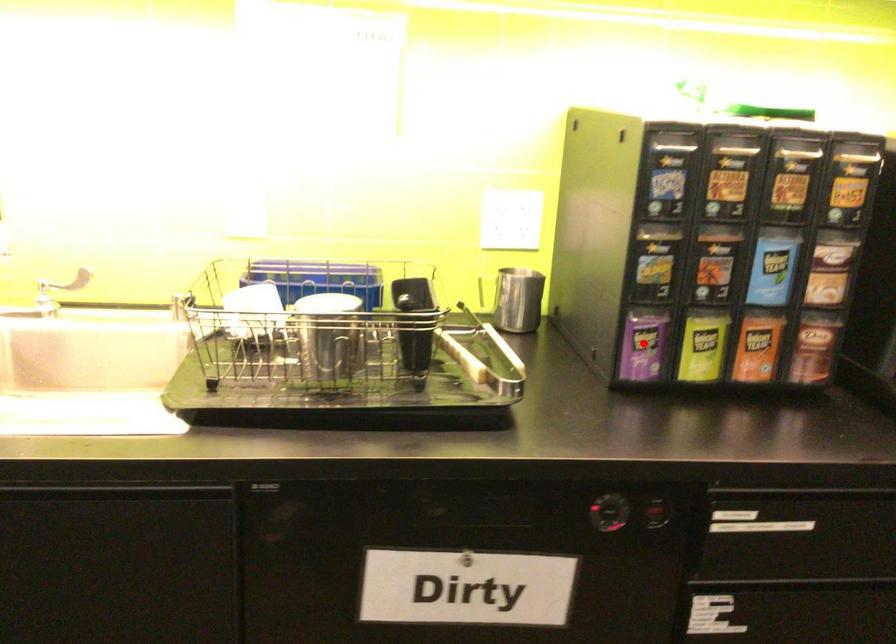
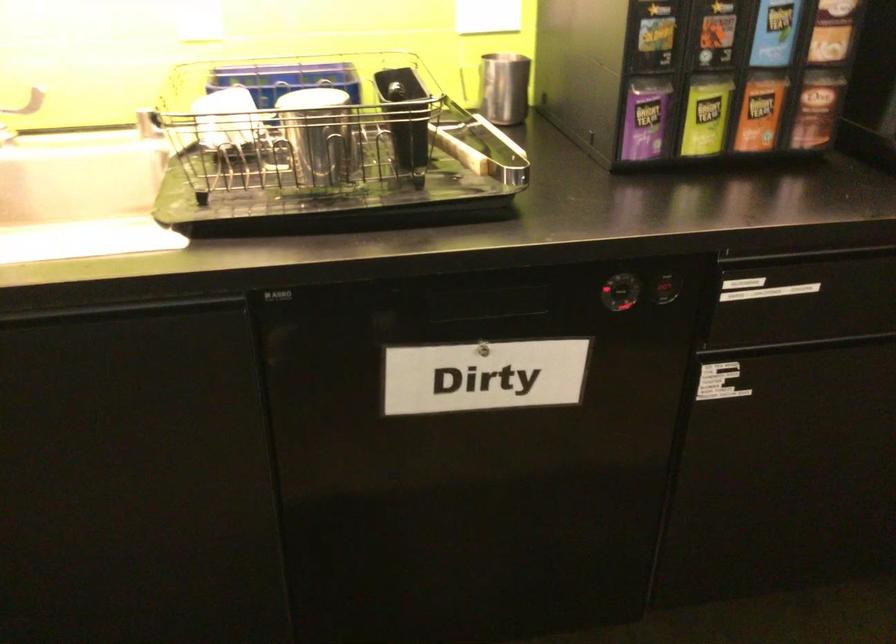
Question: I am providing you with two images of the same scene from different viewpoints. A red point is marked on the first image. Can you still see the location of the red point in image 2?

Choices:
 (A) Yes
 (B) No

Answer: (A)